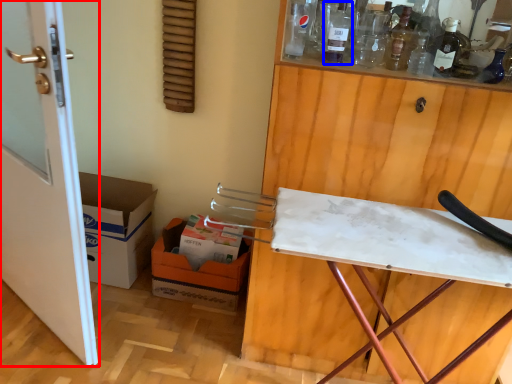
Question: Which of the following is the closest to the observer, door (highlighted by a red box) or bottle (highlighted by a blue box)?

Choices:
 (A) door
 (B) bottle

Answer: (A)